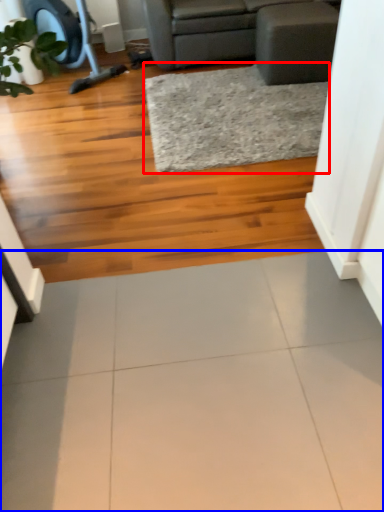
Question: Which of the following is the closest to the observer, mat (highlighted by a red box) or ceramic tile (highlighted by a blue box)?

Choices:
 (A) mat
 (B) ceramic tile

Answer: (B)